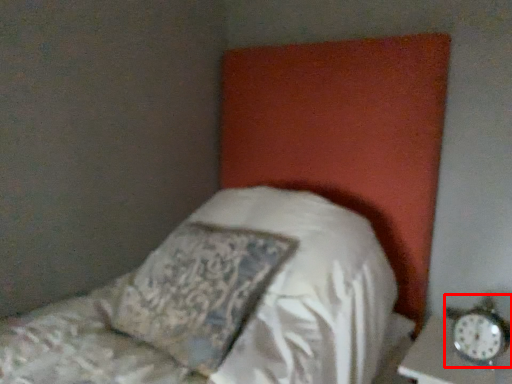
Question: From the image's perspective, where is alarm clock (annotated by the red box) located in relation to pillow in the image?

Choices:
 (A) below
 (B) above

Answer: (A)